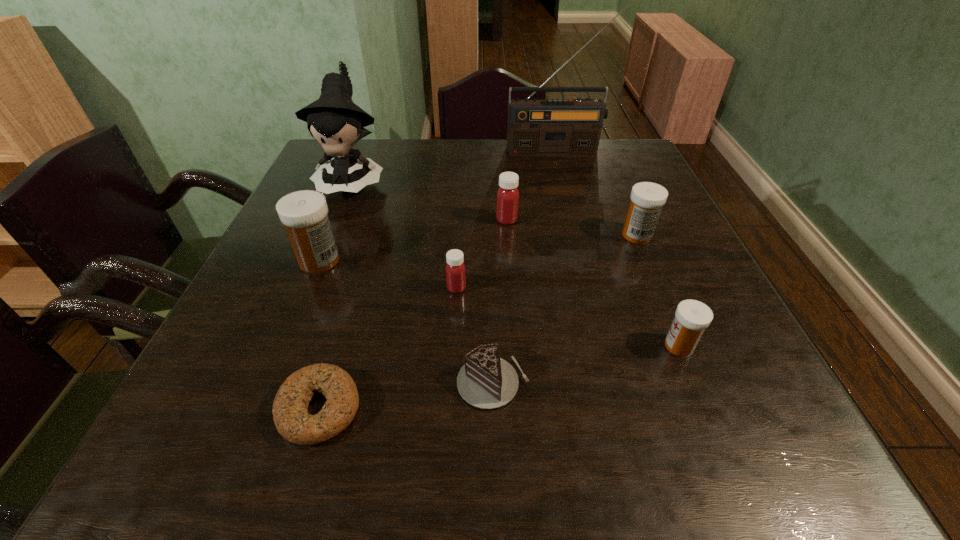
At what (x,y) coordinates should I click in order to perform the action: click on free space between the chocolate cake and the eighth shortest object. Please return your answer as a coordinate pair (x, y). This screenshot has width=960, height=540. Looking at the image, I should click on (422, 282).

In order to click on free area in between the tallest object and the second shortest object in this screenshot , I will do `click(525, 267)`.

In order to click on vacant region between the fourth nearest object and the second nearest white medicine in this screenshot , I will do tap(388, 274).

Find the location of a particular element. vacant space that's between the second shortest object and the smallest white medicine is located at coordinates (586, 364).

This screenshot has width=960, height=540. What are the coordinates of `vacant point located between the second farthest white medicine and the tallest object` in the screenshot? It's located at (438, 206).

What are the coordinates of `free space between the smallest white medicine and the second tallest object` in the screenshot? It's located at (516, 264).

This screenshot has height=540, width=960. I want to click on unoccupied position between the second farthest object and the nearer red medicine, so click(x=405, y=235).

What are the coordinates of `blank region between the third medicine from right to left and the eighth shortest object` in the screenshot? It's located at (430, 201).

Image resolution: width=960 pixels, height=540 pixels. Identify the location of vacant space that's between the nearest medicine and the second farthest object. (516, 264).

Choose which object is the sixth nearest neighbor to the fourth medicine from right to left. Please provide its 2D coordinates. Your answer should be formatted as a tuple, i.e. [(x, y)], where the tuple contains the x and y coordinates of a point satisfying the conditions above.

[(692, 317)]